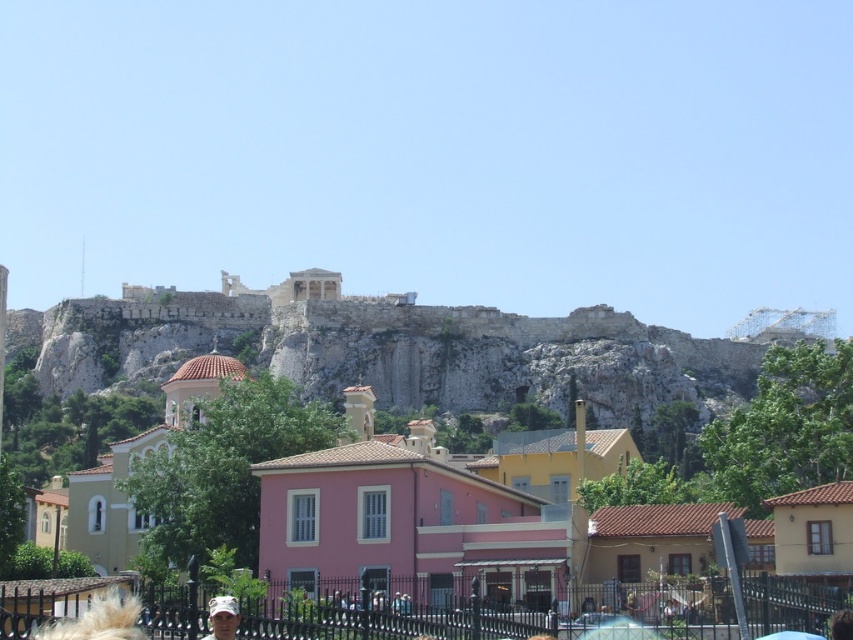
You are standing at the origin point in the image. Which direction should you move to reach the pink matte building at center?

The pink matte building at center is located at coordinates approximately 0.838 along the x axis and 0.479 along the y axis. Since you are at the origin point, you should move towards increasing x and y directions to reach it.

You are a tourist standing in the middle of the scene. You see the pink matte building at center and the camouflage fabric cap at lower center. Which object is located to the right of the other?

The pink matte building at center is positioned on the right side of camouflage fabric cap at lower center.